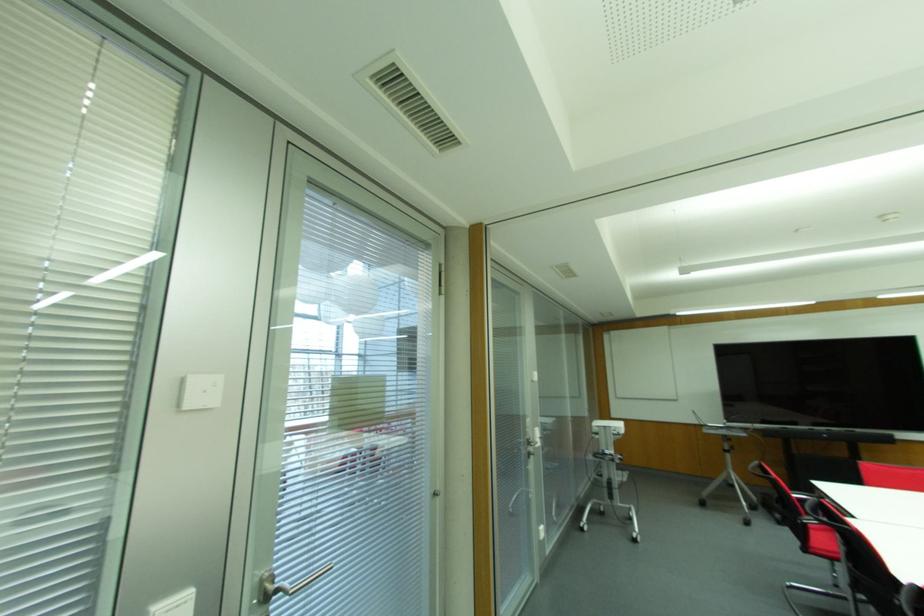
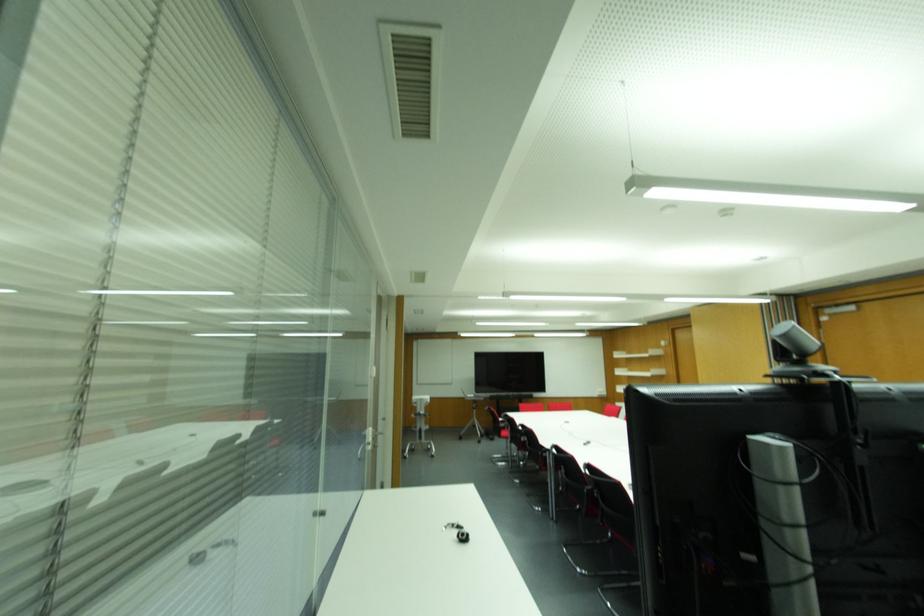
In the second image, find the point that corresponds to pixel 833 559 in the first image.

(505, 438)